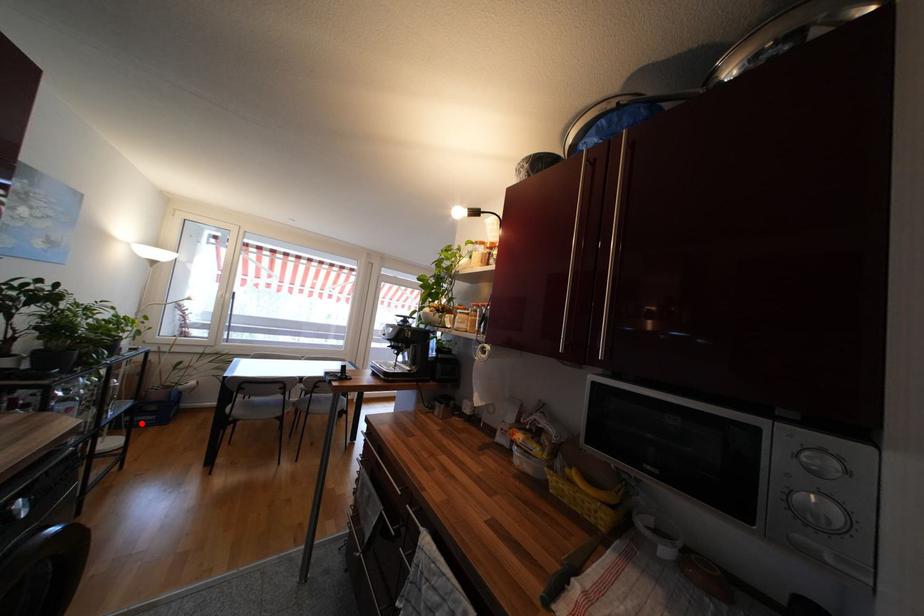
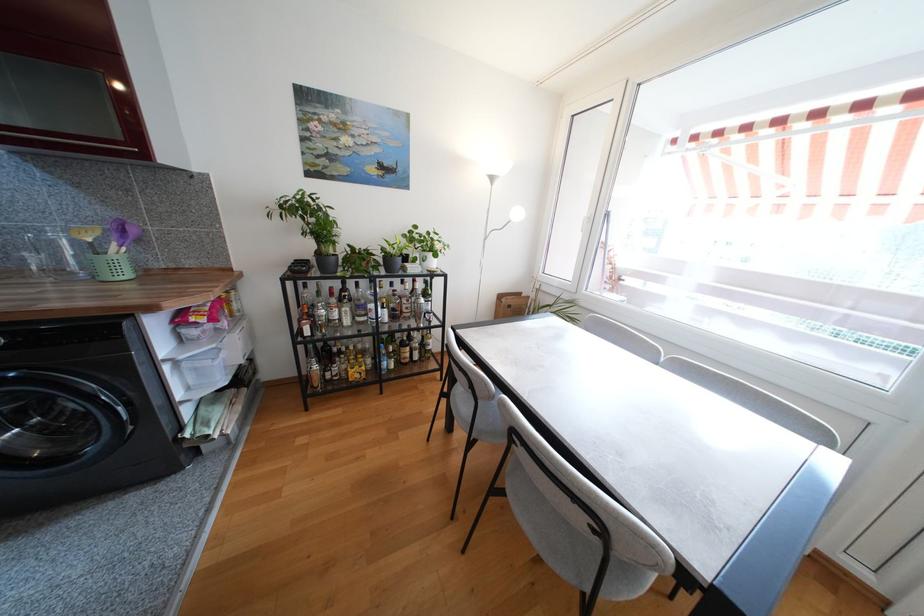
Question: I am providing you with two images of the same scene from different viewpoints. A red point is marked on the first image. At the location where the point appears in image 1, is it still visible in image 2?

Choices:
 (A) Yes
 (B) No

Answer: (B)